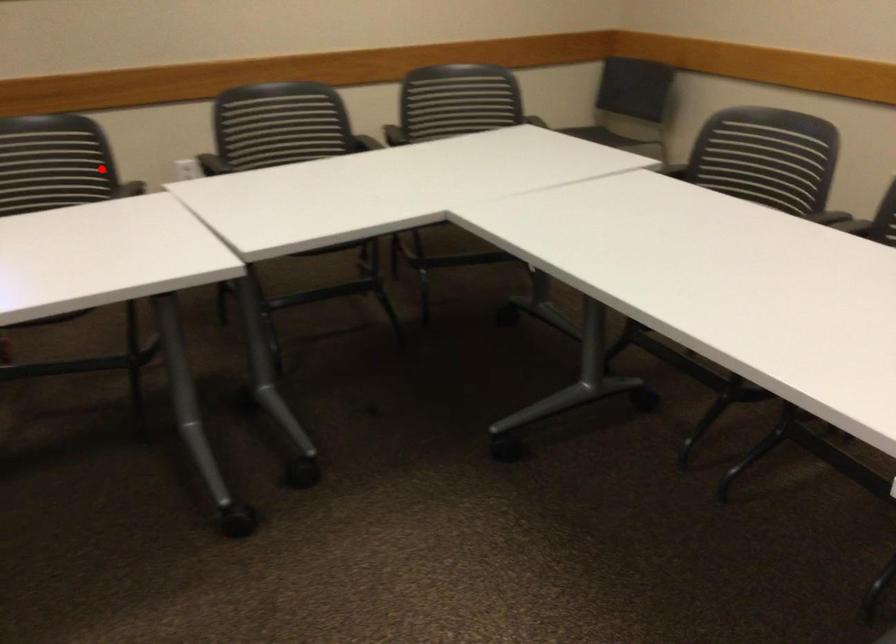
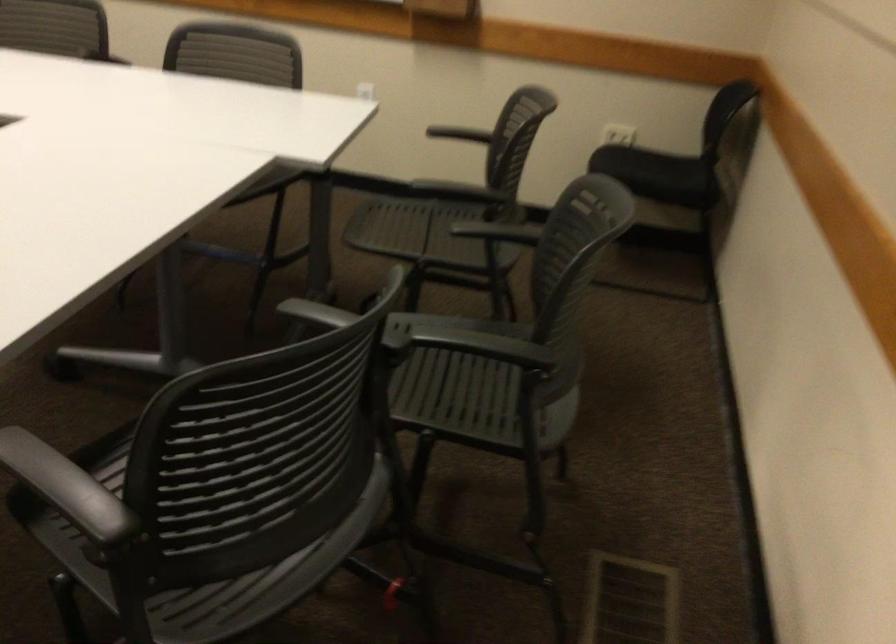
Where in the second image is the point corresponding to the highlighted location from the first image?

(141, 440)